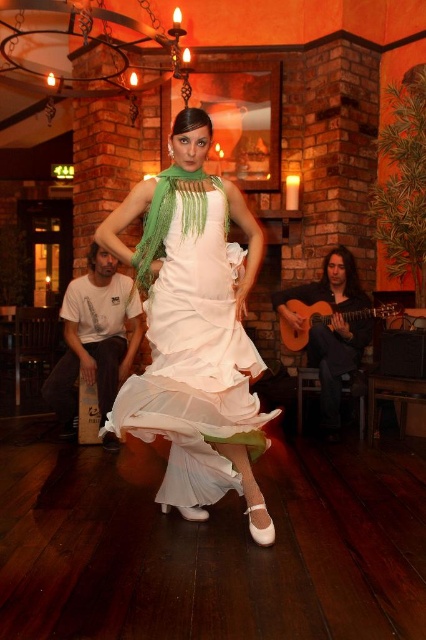
You are a photographer at a cultural event and need to capture a photo of both the white satin dress at center and the acoustic wood guitar at right. Based on their positions, which object should you focus on first if you want to frame them from left to right?

The white satin dress at center is positioned on the left side of the acoustic wood guitar at right, so you should focus on the white satin dress at center first to frame them from left to right.

You are a photographer setting up for a performance. You need to capture both the white satin dress at center and the acoustic wood guitar at right in your shot. Which object should you focus on first to ensure it appears larger in the photo?

The white satin dress at center is taller than the acoustic wood guitar at right, so focusing on it first will ensure it appears larger in the photo.

You are a stagehand who needs to place a 1.5 meter long banner between the white satin dress at center and the acoustic wood guitar at right. Is there enough space to fit the banner horizontally between them?

The distance between the white satin dress at center and the acoustic wood guitar at right is 1.74 meters. Since the banner is 1.5 meters long, there is sufficient space to place it horizontally between them.